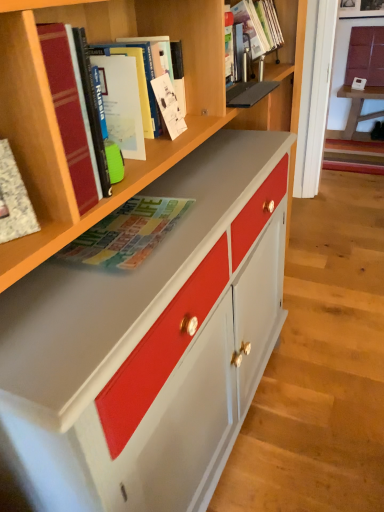
Question: Considering the relative sizes of matte white cabinet at upper right and matte magazine at center, positioned as the third book in front-to-back order, in the image provided, is matte white cabinet at upper right taller than matte magazine at center, positioned as the third book in front-to-back order,?

Choices:
 (A) no
 (B) yes

Answer: (B)

Question: Is matte magazine at center, positioned as the third book in front-to-back order, surrounded by matte white cabinet at upper right?

Choices:
 (A) yes
 (B) no

Answer: (B)

Question: Is matte white cabinet at upper right aimed at matte magazine at center, positioned as the third book in front-to-back order?

Choices:
 (A) yes
 (B) no

Answer: (A)

Question: Is the surface of matte white cabinet at upper right in direct contact with matte magazine at center, positioned as the third book in front-to-back order?

Choices:
 (A) no
 (B) yes

Answer: (A)

Question: Does matte white cabinet at upper right have a smaller size compared to matte magazine at center, positioned as the third book in front-to-back order?

Choices:
 (A) no
 (B) yes

Answer: (A)

Question: Is hardcover book at upper left, positioned as the second book in front-to-back order, wider or thinner than matte hardcover book at upper center, marked as the 3th book in a back-to-front arrangement?

Choices:
 (A) thin
 (B) wide

Answer: (B)

Question: Is hardcover book at upper left, which ranks as the 5th book in back-to-front order, in front of or behind matte hardcover book at upper center, which is counted as the fourth book, starting from the front, in the image?

Choices:
 (A) front
 (B) behind

Answer: (A)

Question: Is point (67, 110) closer or farther from the camera than point (152, 110)?

Choices:
 (A) farther
 (B) closer

Answer: (B)

Question: Would you say hardcover book at upper left, which ranks as the 5th book in back-to-front order, is to the left or to the right of matte hardcover book at upper center, which is counted as the fourth book, starting from the front, in the picture?

Choices:
 (A) left
 (B) right

Answer: (A)

Question: Does point (119, 227) appear closer or farther from the camera than point (377, 44)?

Choices:
 (A) closer
 (B) farther

Answer: (A)

Question: From the image's perspective, is matte magazine at center, acting as the fourth book starting from the back, positioned above or below matte white cabinet at upper right?

Choices:
 (A) below
 (B) above

Answer: (A)

Question: Looking at their shapes, would you say matte magazine at center, acting as the fourth book starting from the back, is wider or thinner than matte white cabinet at upper right?

Choices:
 (A) thin
 (B) wide

Answer: (B)

Question: Based on their sizes in the image, would you say matte magazine at center, positioned as the third book in front-to-back order, is bigger or smaller than matte white cabinet at upper right?

Choices:
 (A) small
 (B) big

Answer: (A)

Question: Is matte hardcover book at upper center, which is counted as the fourth book, starting from the front, inside or outside of white textured notebook at left, which is the 6th book from back to front?

Choices:
 (A) outside
 (B) inside

Answer: (A)

Question: From a real-world perspective, is matte hardcover book at upper center, which is counted as the fourth book, starting from the front, physically located above or below white textured notebook at left, which is the 6th book from back to front?

Choices:
 (A) above
 (B) below

Answer: (A)